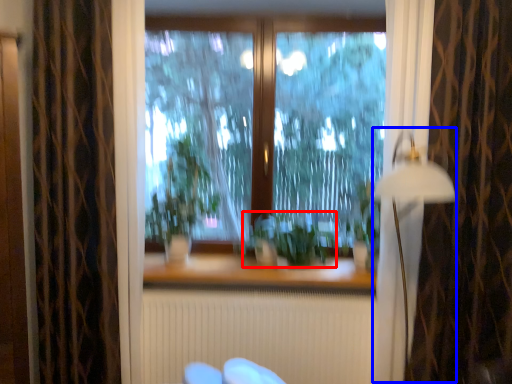
Question: Among these objects, which one is nearest to the camera, plant (highlighted by a red box) or lamp (highlighted by a blue box)?

Choices:
 (A) plant
 (B) lamp

Answer: (B)